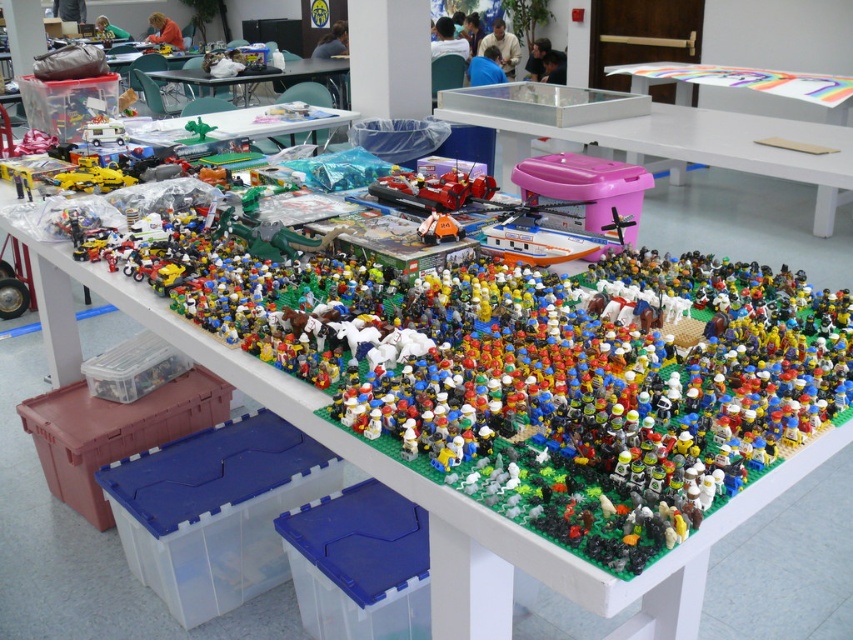
You are a Lego enthusiast observing the display and want to take a photo of the green plastic table at upper center and the matte plastic table at upper center. Which one will appear larger in your photo?

The green plastic table at upper center will appear larger in the photo because it is closer to the viewer than the matte plastic table at upper center.

You are a Lego enthusiast who wants to move a box from the pink plastic bin at center to the matte plastic table at upper center. The box is 1 meter long. Can you carry it horizontally without bending it between these two objects?

The distance between the pink plastic bin at center and the matte plastic table at upper center is 3.66 meters. Since the box is only 1 meter long, you can easily carry it horizontally without bending it between these two objects because the distance is more than sufficient.